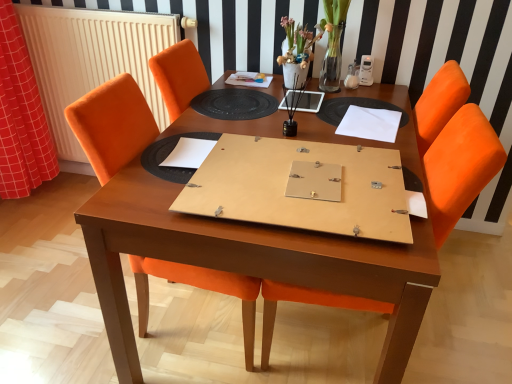
I want to click on empty space that is to the right of orange fabric chair at center, which appears as the 2th chair when viewed from the left, so click(x=460, y=327).